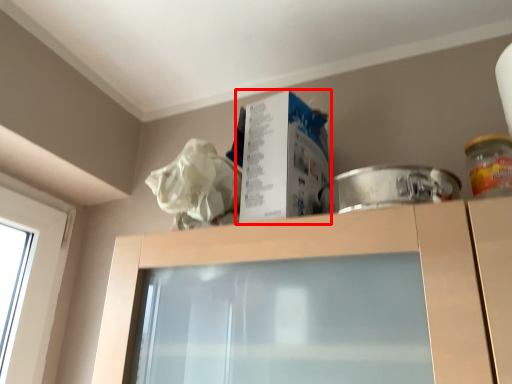
Question: From the image's perspective, where is box (annotated by the red box) located in relation to glass jar in the image?

Choices:
 (A) below
 (B) above

Answer: (B)